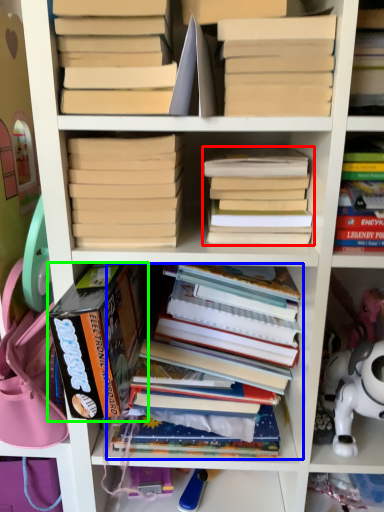
Question: Estimate the real-world distances between objects in this image. Which object is closer to book (highlighted by a red box), book (highlighted by a blue box) or book (highlighted by a green box)?

Choices:
 (A) book
 (B) book

Answer: (B)